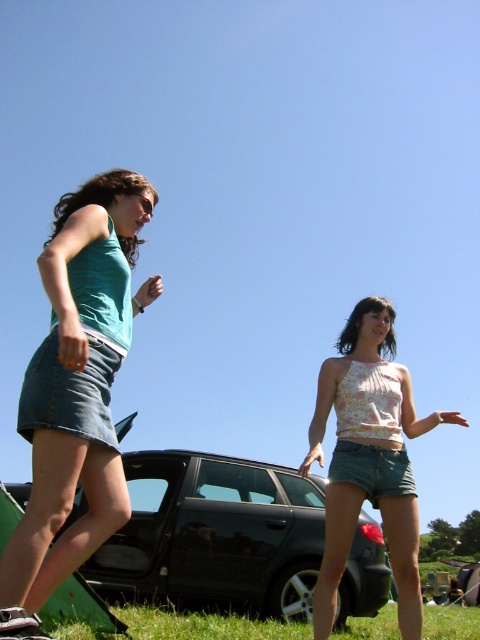
Does floral fabric top at center appear under green grass at lower center?

Incorrect, floral fabric top at center is not positioned below green grass at lower center.

Between point (331, 369) and point (296, 636), which one is positioned behind?

The point (296, 636) is behind.

Identify the location of floral fabric top at center. The height and width of the screenshot is (640, 480). (369, 458).

Is matte denim skirt at left further to the viewer compared to green grass at lower center?

No, it is in front of green grass at lower center.

Does matte denim skirt at left have a smaller size compared to green grass at lower center?

Yes.

Who is more distant from viewer, (38, 492) or (260, 620)?

Positioned behind is point (260, 620).

The height and width of the screenshot is (640, 480). Identify the location of matte denim skirt at left. (76, 390).

Can you confirm if matte denim skirt at left is shorter than floral fabric top at center?

Yes.

Between matte denim skirt at left and floral fabric top at center, which one is positioned higher?

matte denim skirt at left is higher up.

Is point (71, 266) behind point (372, 340)?

No.

I want to click on matte denim skirt at left, so click(x=76, y=390).